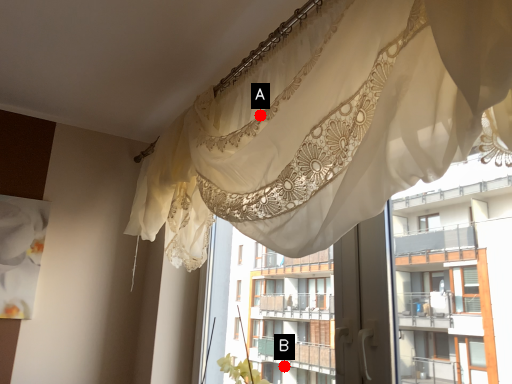
Question: Two points are circled on the image, labeled by A and B beside each circle. Among these points, which one is farthest from the camera?

Choices:
 (A) A is further
 (B) B is further

Answer: (B)